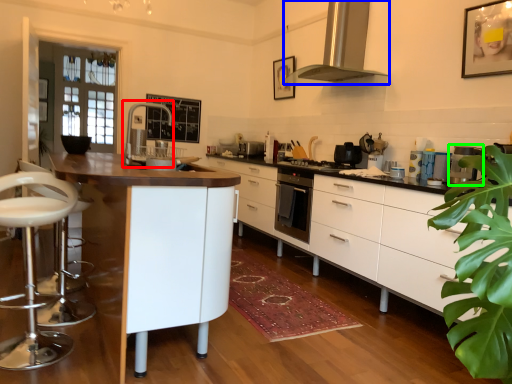
Question: Which object is the farthest from faucet (highlighted by a red box)? Choose among these: home appliance (highlighted by a blue box) or kitchen appliance (highlighted by a green box).

Choices:
 (A) home appliance
 (B) kitchen appliance

Answer: (B)